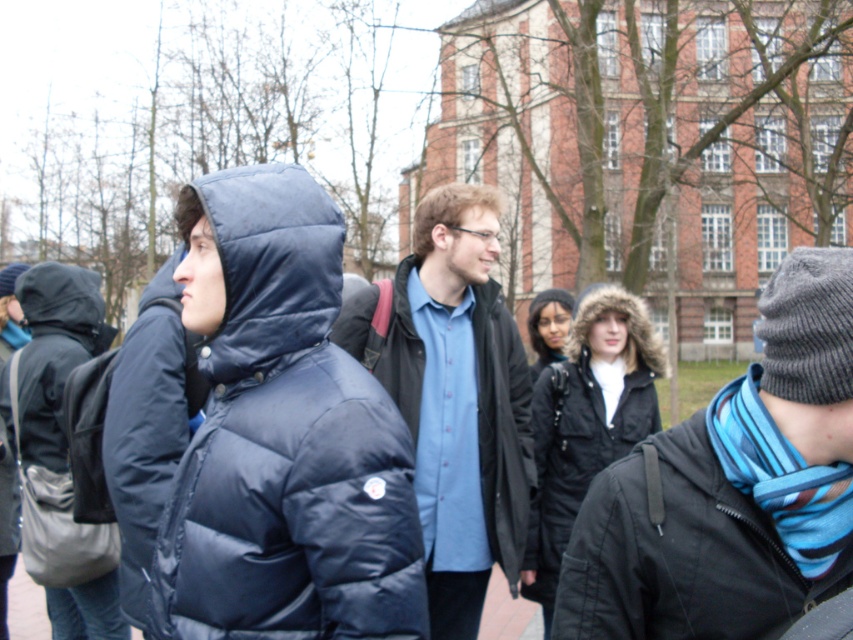
Is matte blue shirt at center taller than black fur-lined coat at center?

Yes, matte blue shirt at center is taller than black fur-lined coat at center.

Does matte blue shirt at center appear under black fur-lined coat at center?

No.

Is point (445, 275) positioned before point (619, 432)?

Yes, it is.

Where is `matte blue shirt at center`? Image resolution: width=853 pixels, height=640 pixels. matte blue shirt at center is located at coordinates (454, 396).

Who is positioned more to the left, matte black backpack at left or matte black coat at left?

matte black coat at left is more to the left.

Measure the distance between point (47, 330) and camera.

A distance of 5.54 meters exists between point (47, 330) and camera.

This screenshot has height=640, width=853. What are the coordinates of `matte black backpack at left` in the screenshot? It's located at (57, 444).

Is matte black backpack at left to the right of black matte jacket at lower right from the viewer's perspective?

No, matte black backpack at left is not to the right of black matte jacket at lower right.

Does matte black backpack at left have a larger size compared to black matte jacket at lower right?

Yes, matte black backpack at left is bigger than black matte jacket at lower right.

Is point (85, 600) closer to viewer compared to point (691, 602)?

That is False.

Image resolution: width=853 pixels, height=640 pixels. What are the coordinates of `matte black backpack at left` in the screenshot? It's located at (57, 444).